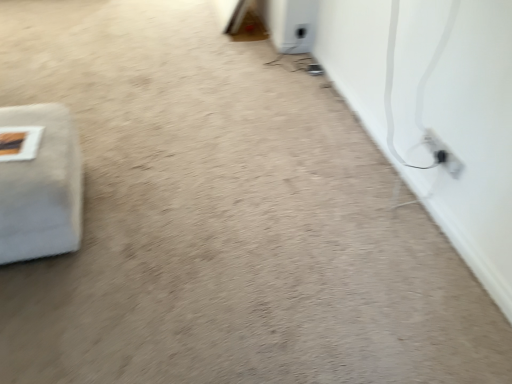
Question: From a real-world perspective, relative to black plastic electric outlet at lower right, is white fabric at left vertically above or below?

Choices:
 (A) above
 (B) below

Answer: (B)

Question: Is white fabric at left taller or shorter than black plastic electric outlet at lower right?

Choices:
 (A) short
 (B) tall

Answer: (B)

Question: Considering the positions of white fabric at left and black plastic electric outlet at lower right in the image, is white fabric at left wider or thinner than black plastic electric outlet at lower right?

Choices:
 (A) wide
 (B) thin

Answer: (A)

Question: From a real-world perspective, is black plastic electric outlet at lower right physically located above or below white fabric at left?

Choices:
 (A) above
 (B) below

Answer: (A)

Question: In the image, is black plastic electric outlet at lower right positioned in front of or behind white fabric at left?

Choices:
 (A) front
 (B) behind

Answer: (B)

Question: Based on their sizes in the image, would you say black plastic electric outlet at lower right is bigger or smaller than white fabric at left?

Choices:
 (A) small
 (B) big

Answer: (A)

Question: From the image's perspective, relative to white fabric at left, is black plastic electric outlet at lower right above or below?

Choices:
 (A) above
 (B) below

Answer: (A)